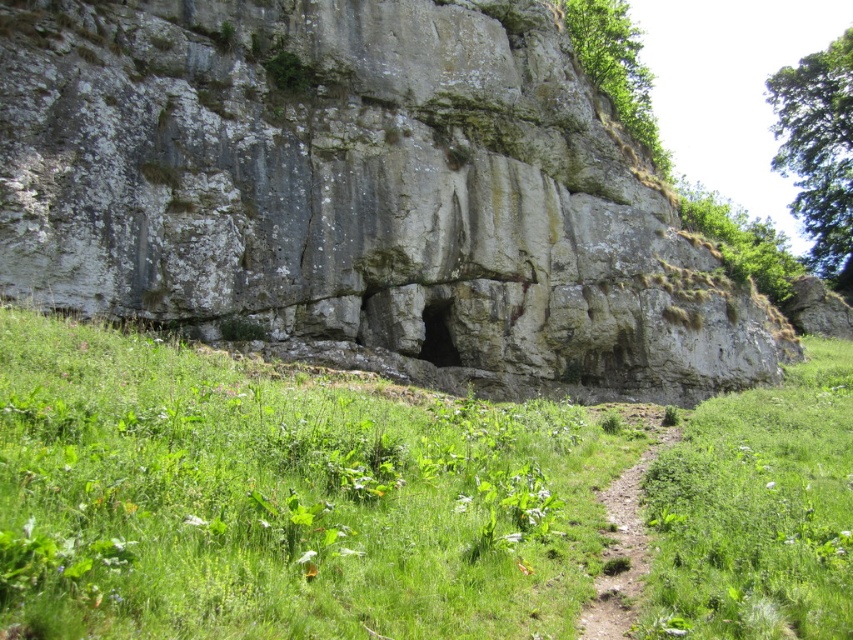
How much distance is there between gray stone cave at center and green grassy at center?

gray stone cave at center and green grassy at center are 34.62 feet apart from each other.

Between gray stone cave at center and green grassy at center, which one has less height?

Standing shorter between the two is green grassy at center.

The height and width of the screenshot is (640, 853). Find the location of `gray stone cave at center`. gray stone cave at center is located at coordinates (358, 195).

Where is `gray stone cave at center`? The width and height of the screenshot is (853, 640). gray stone cave at center is located at coordinates (358, 195).

Is gray stone cave at center to the left of smooth stone hole at center from the viewer's perspective?

Incorrect, gray stone cave at center is not on the left side of smooth stone hole at center.

Can you confirm if gray stone cave at center is taller than smooth stone hole at center?

Indeed, gray stone cave at center has a greater height compared to smooth stone hole at center.

Describe the element at coordinates (358, 195) in the screenshot. I see `gray stone cave at center` at that location.

Identify the location of gray stone cave at center. The width and height of the screenshot is (853, 640). (358, 195).

Image resolution: width=853 pixels, height=640 pixels. What do you see at coordinates (281, 497) in the screenshot?
I see `green grassy at center` at bounding box center [281, 497].

Between point (506, 620) and point (614, 584), which one is positioned in front?

Point (506, 620) is more forward.

Where is `green grassy at center`? Image resolution: width=853 pixels, height=640 pixels. green grassy at center is located at coordinates (281, 497).